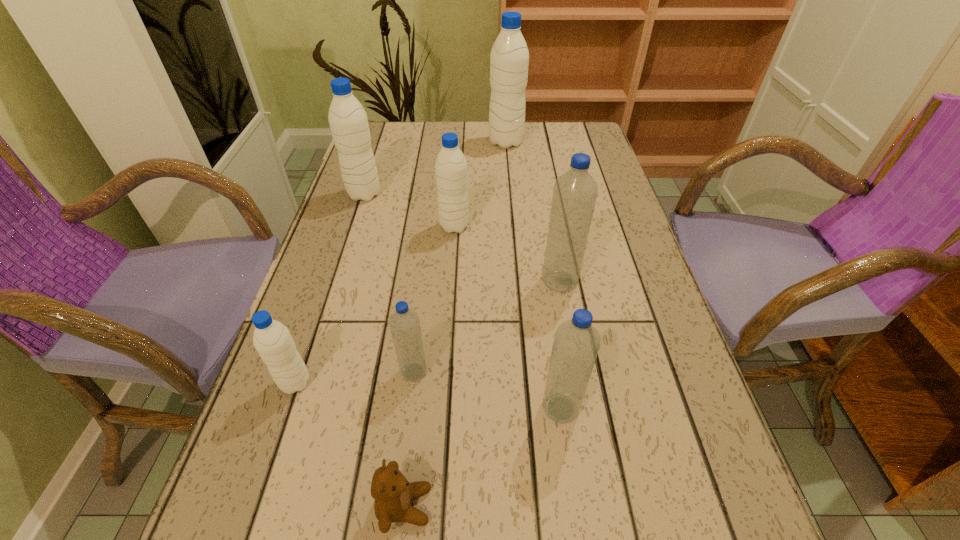
Where is `vacant area that satisfies the following two spatial constraints: 1. on the back side of the second farthest water bottle; 2. on the right side of the smallest gray water bottle`? vacant area that satisfies the following two spatial constraints: 1. on the back side of the second farthest water bottle; 2. on the right side of the smallest gray water bottle is located at coordinates (359, 194).